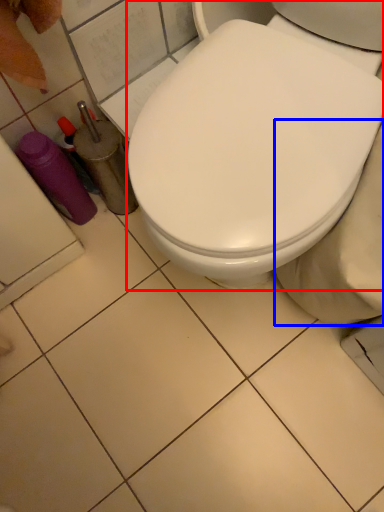
Question: Which object appears farthest to the camera in this image, toilet (highlighted by a red box) or bidet (highlighted by a blue box)?

Choices:
 (A) toilet
 (B) bidet

Answer: (B)